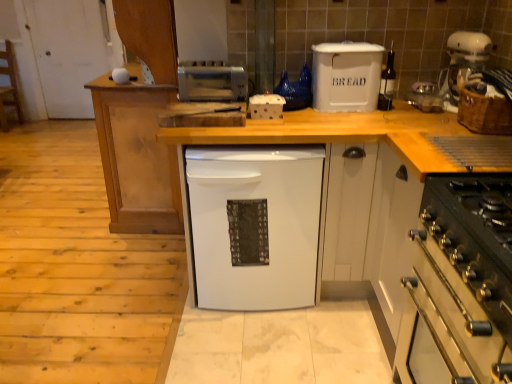
This screenshot has width=512, height=384. I want to click on vacant space situated on the left part of woven brown basket at right, so click(432, 128).